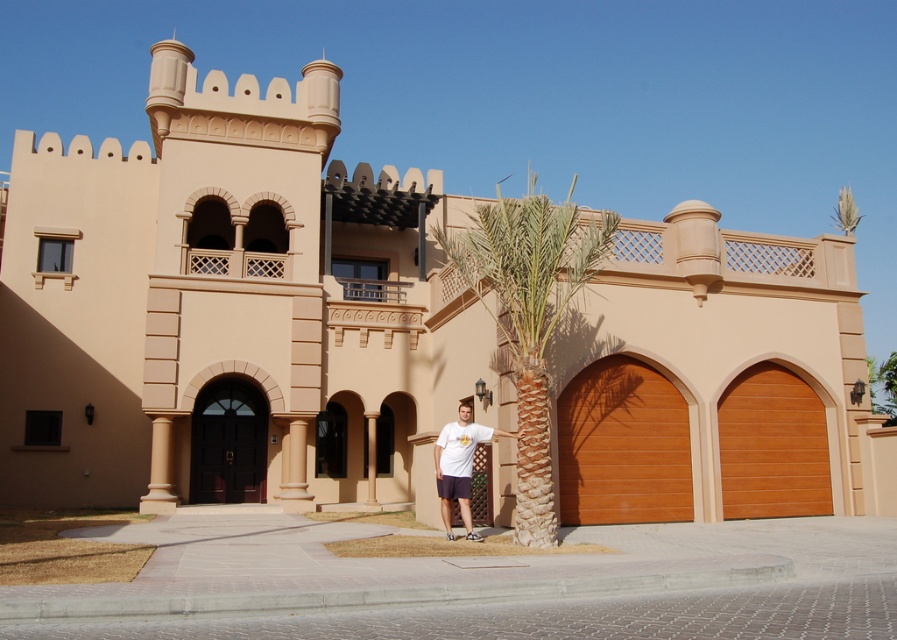
Question: Based on their relative distances, which object is farther from the dark brown wooden garage door at center?

Choices:
 (A) white cotton t-shirt at center
 (B) beige stone pillar at center
 (C) wooden at center

Answer: (A)

Question: Which object appears closest to the camera in this image?

Choices:
 (A) wooden at center
 (B) white cotton t-shirt at center

Answer: (B)

Question: Which point appears farthest from the camera in this image?

Choices:
 (A) (759, 451)
 (B) (469, 490)
 (C) (232, 477)

Answer: (C)

Question: Can you confirm if green leafy palm tree at center is positioned below dark brown wooden garage door at center?

Choices:
 (A) yes
 (B) no

Answer: (B)

Question: Is wooden at center positioned at the back of brown wooden garage door at lower right?

Choices:
 (A) yes
 (B) no

Answer: (B)

Question: Can you confirm if brown wooden garage door at lower right is thinner than dark brown wooden garage door at center?

Choices:
 (A) no
 (B) yes

Answer: (A)